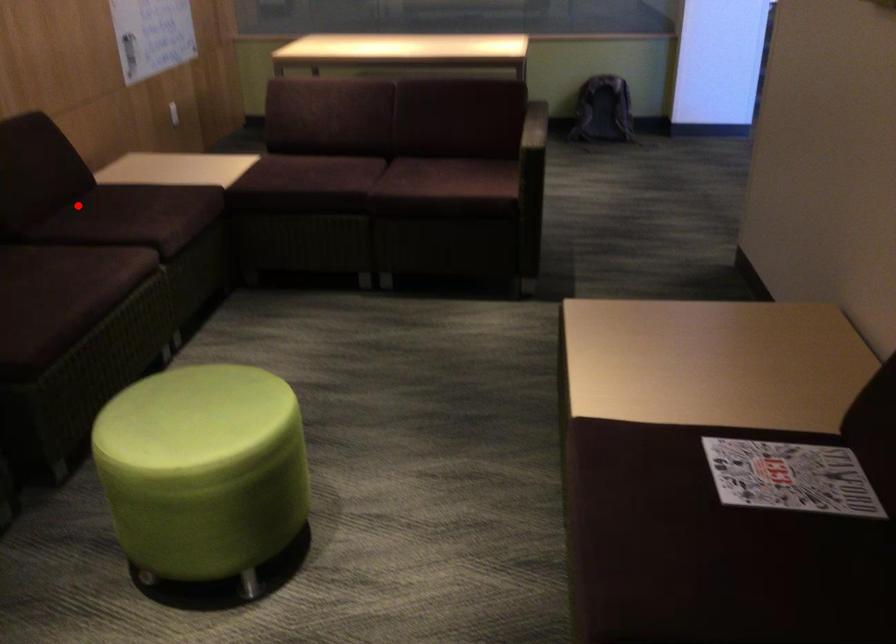
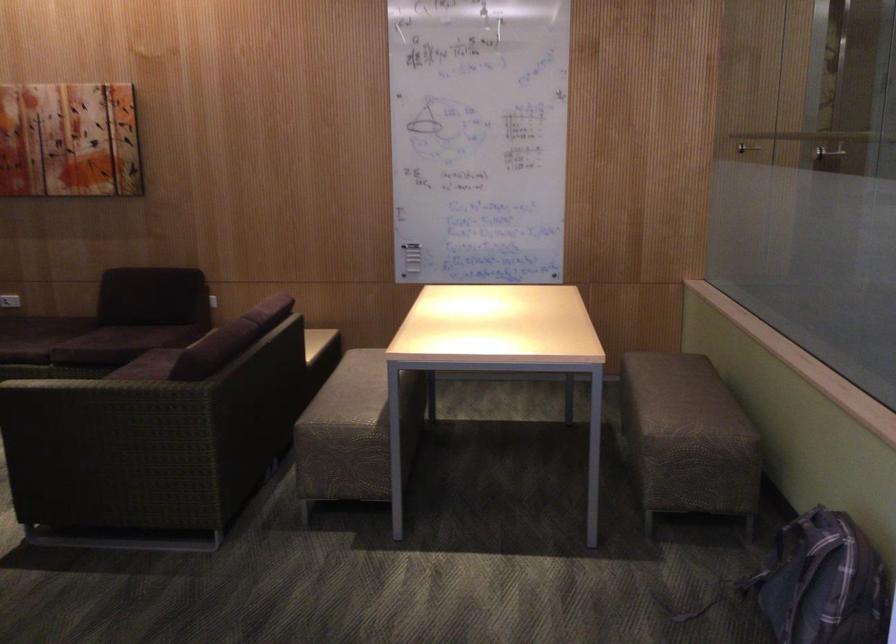
Question: I am providing you with two images of the same scene from different viewpoints. Image1 has a red point marked. In image2, the corresponding 3D location appears at what relative position? Reply with the corresponding letter.

Choices:
 (A) Closer
 (B) Farther

Answer: (B)